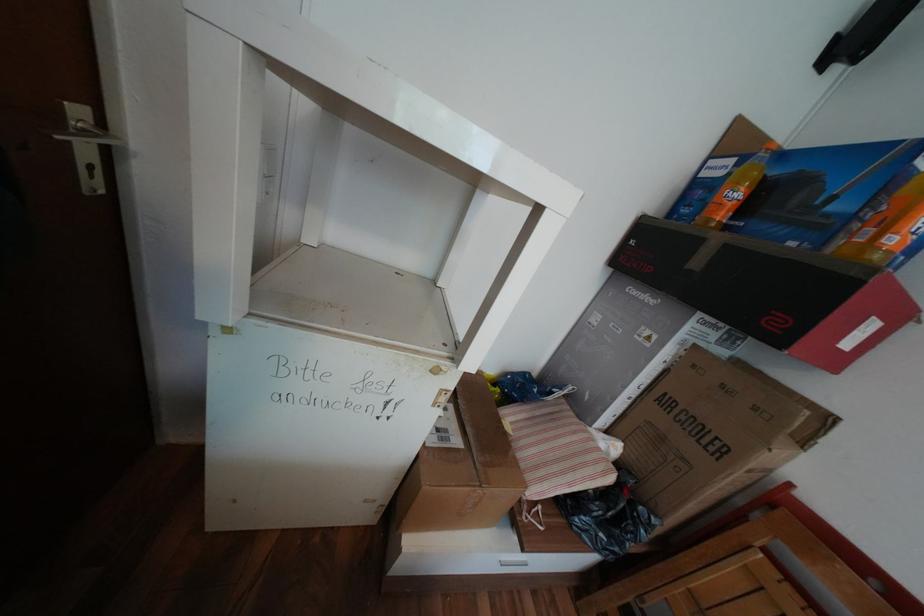
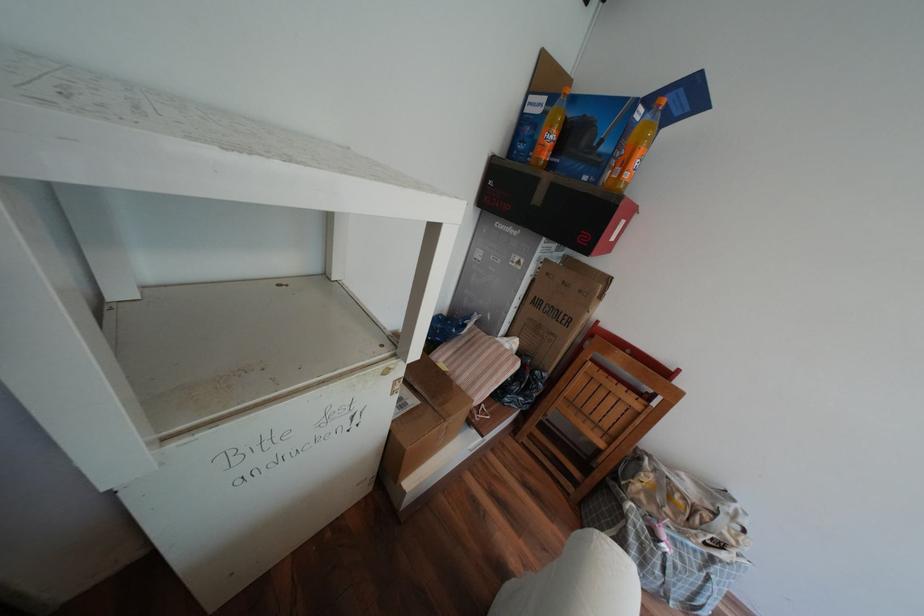
In the second image, find the point that corresponds to (x=642, y=292) in the first image.

(511, 225)